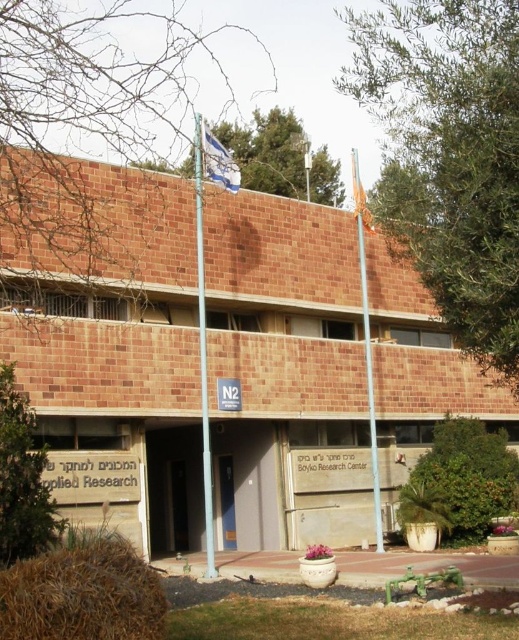
Question: Can you confirm if blue fabric flag at upper center is positioned to the right of orange fabric flag at upper right?

Choices:
 (A) no
 (B) yes

Answer: (A)

Question: Does green metallic flag pole at center appear on the right side of metallic silver flag pole at center?

Choices:
 (A) yes
 (B) no

Answer: (B)

Question: Which object appears farthest from the camera in this image?

Choices:
 (A) orange fabric flag at upper right
 (B) green metallic flag pole at center

Answer: (A)

Question: Among these objects, which one is farthest from the camera?

Choices:
 (A) metallic silver flag pole at center
 (B) green metallic flag pole at center

Answer: (A)

Question: Considering the relative positions of brown brick building at center and green metallic flag pole at center in the image provided, where is brown brick building at center located with respect to green metallic flag pole at center?

Choices:
 (A) below
 (B) above

Answer: (A)

Question: Estimate the real-world distances between objects in this image. Which object is farther from the brown brick building at center?

Choices:
 (A) metallic silver flag pole at center
 (B) orange fabric flag at upper right
 (C) blue fabric flag at upper center

Answer: (B)